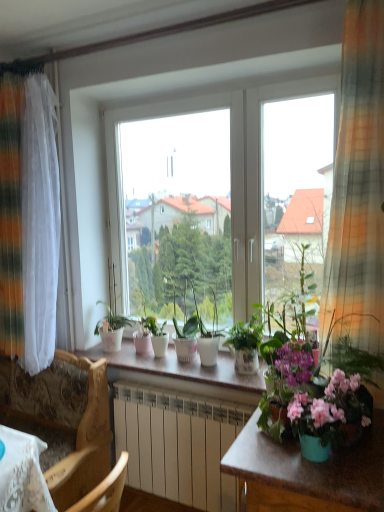
Question: From their relative heights in the image, would you say white glossy pot at center, arranged as the third houseplant when viewed from the right, is taller or shorter than matte white pot at center, positioned as the 4th houseplant in right-to-left order?

Choices:
 (A) tall
 (B) short

Answer: (A)

Question: In terms of size, does white glossy pot at center, arranged as the third houseplant when viewed from the right, appear bigger or smaller than matte white pot at center, positioned as the 4th houseplant in right-to-left order?

Choices:
 (A) big
 (B) small

Answer: (A)

Question: Considering the real-world distances, which object is farthest from the green glossy plant at center, which ranks as the sixth houseplant in left-to-right order?

Choices:
 (A) white glossy pot at center, the second houseplant from the right
 (B) wooden chair at lower left
 (C) matte white pot at center, the 2th houseplant from the left
 (D) matte white pot at center, positioned as the 4th houseplant in right-to-left order
 (E) white glossy pot at center, arranged as the third houseplant when viewed from the right

Answer: (B)

Question: Which object is positioned farthest from the white glossy pot at center, the first houseplant when ordered from left to right?

Choices:
 (A) matte brown table at lower right
 (B) matte white pot at center, which appears as the 3th houseplant when viewed from the left
 (C) white glossy counter top at center
 (D) matte white pot at center, the 5th houseplant when ordered from right to left
 (E) white glossy pot at center, the 4th houseplant when ordered from left to right

Answer: (A)